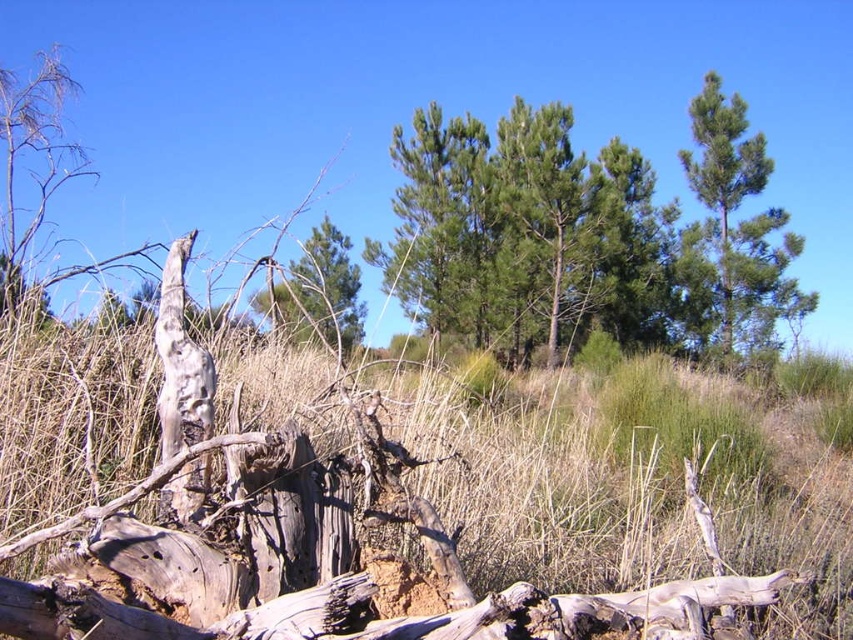
Measure the distance between green needle-like at center and green leafy tree at center.

The distance of green needle-like at center from green leafy tree at center is 21.91 feet.

Measure the distance from green needle-like at center to green leafy tree at center.

A distance of 6.68 meters exists between green needle-like at center and green leafy tree at center.

Where is `green needle-like at center`? The width and height of the screenshot is (853, 640). green needle-like at center is located at coordinates (440, 225).

Between green needle-like at upper right and green leafy tree at center, which one is positioned lower?

Positioned lower is green leafy tree at center.

This screenshot has height=640, width=853. I want to click on green needle-like at upper right, so click(x=740, y=220).

This screenshot has height=640, width=853. What are the coordinates of `green needle-like at upper right` in the screenshot? It's located at (740, 220).

Does green needle-like at center have a smaller size compared to green needle-like at upper right?

Incorrect, green needle-like at center is not smaller in size than green needle-like at upper right.

Does green needle-like at center appear on the right side of green needle-like at upper right?

No, green needle-like at center is not to the right of green needle-like at upper right.

Identify the location of green needle-like at center. This screenshot has height=640, width=853. (440, 225).